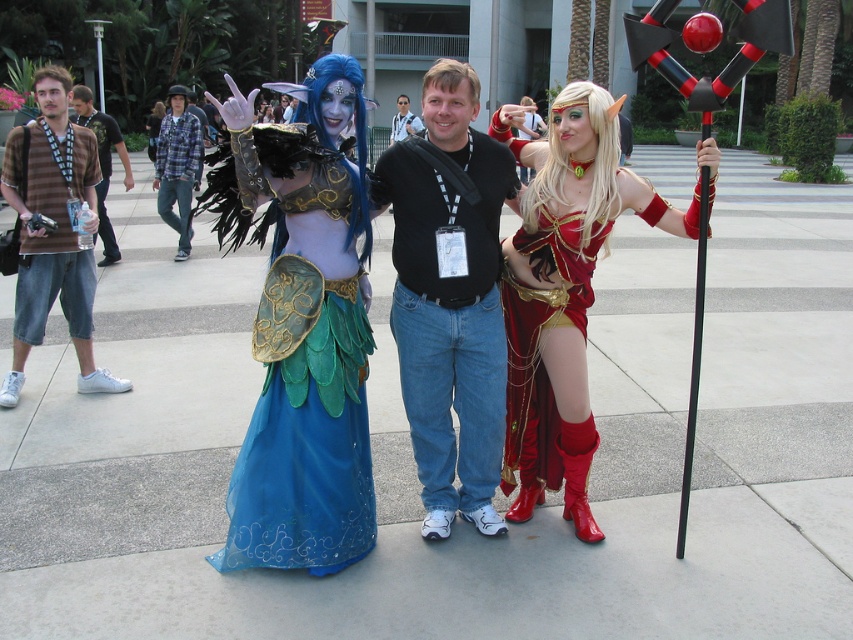
Is the position of striped cotton shirt at left less distant than that of shiny red fabric dress at right?

No, striped cotton shirt at left is behind shiny red fabric dress at right.

Who is positioned more to the right, striped cotton shirt at left or shiny red fabric dress at right?

Positioned to the right is shiny red fabric dress at right.

The height and width of the screenshot is (640, 853). What do you see at coordinates (53, 232) in the screenshot? I see `striped cotton shirt at left` at bounding box center [53, 232].

Find the location of `striped cotton shirt at left`. striped cotton shirt at left is located at coordinates [53, 232].

Is black cotton shirt at center in front of black cotton t-shirt at center?

Yes, black cotton shirt at center is closer to the viewer.

Does black cotton shirt at center have a lesser width compared to black cotton t-shirt at center?

Yes.

This screenshot has height=640, width=853. Find the location of `black cotton shirt at center`. black cotton shirt at center is located at coordinates (450, 298).

How distant is matte blue fabric dress at left from striped cotton shirt at left?

matte blue fabric dress at left is 2.48 meters away from striped cotton shirt at left.

Does matte blue fabric dress at left have a lesser height compared to striped cotton shirt at left?

Yes, matte blue fabric dress at left is shorter than striped cotton shirt at left.

Image resolution: width=853 pixels, height=640 pixels. I want to click on matte blue fabric dress at left, so click(x=450, y=304).

Where is `matte blue fabric dress at left`? This screenshot has height=640, width=853. matte blue fabric dress at left is located at coordinates (450, 304).